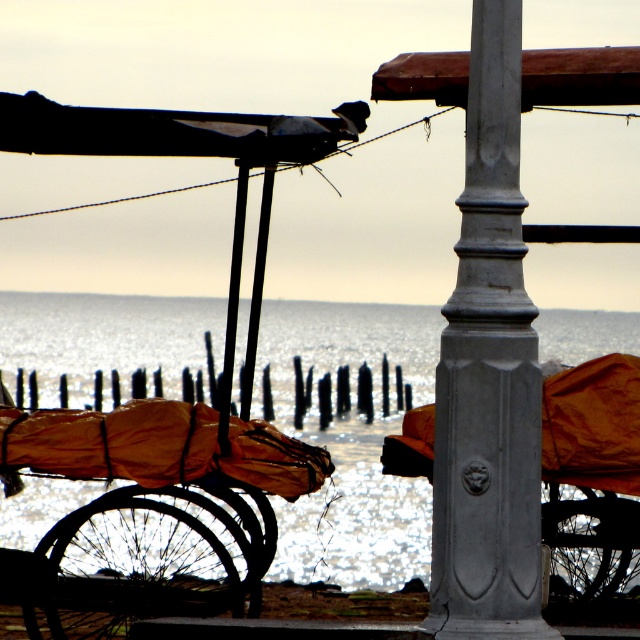
You are an artist trying to paint this coastal scene. You notice the shiny metallic water at center and the gray polished metal pole at center. Which object should you paint first if you want to follow the rule of focusing on the larger elements before smaller ones?

The shiny metallic water at center should be painted first because it is larger in size compared to the gray polished metal pole at center.

You are standing in the coastal scene and want to walk from the weathered streetlamp on the right to the bicycle covered with an orange tarp on the left. Which point, point 1 at coordinates [387,326] or point 2 at coordinates [513,72], is closer to your starting position near the streetlamp?

Point 1 at coordinates [387,326] is closer to your starting position near the streetlamp because it is further to the viewer than point 2 at coordinates [513,72], meaning it is physically nearer in the scene.